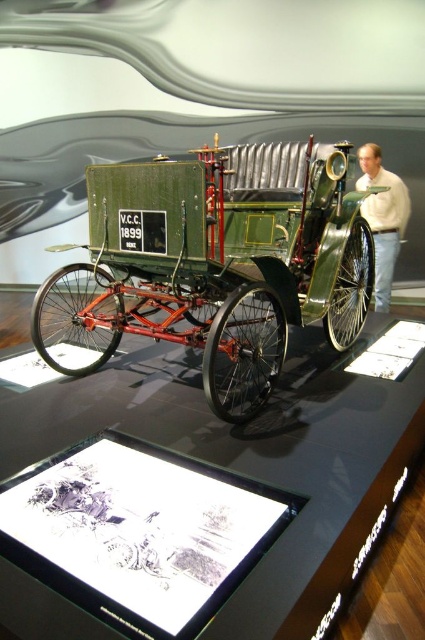
Question: Can you confirm if green matte wagon at center is wider than light beige sweater at right?

Choices:
 (A) no
 (B) yes

Answer: (B)

Question: Does green matte wagon at center appear on the left side of light beige sweater at right?

Choices:
 (A) no
 (B) yes

Answer: (B)

Question: Is green matte wagon at center to the left of light beige sweater at right from the viewer's perspective?

Choices:
 (A) no
 (B) yes

Answer: (B)

Question: Which of the following is the farthest from the observer?

Choices:
 (A) (272, 371)
 (B) (385, 218)

Answer: (B)